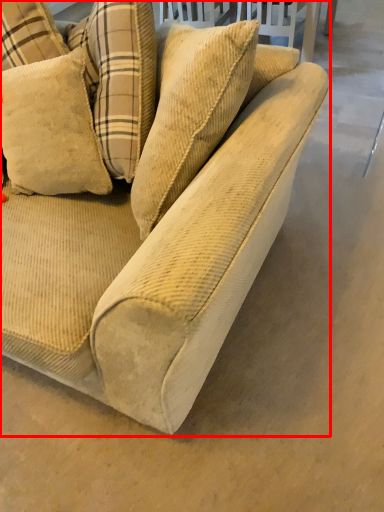
Question: Considering the relative positions of studio couch (annotated by the red box) and pillow in the image provided, where is studio couch (annotated by the red box) located with respect to the staircase?

Choices:
 (A) right
 (B) left

Answer: (A)